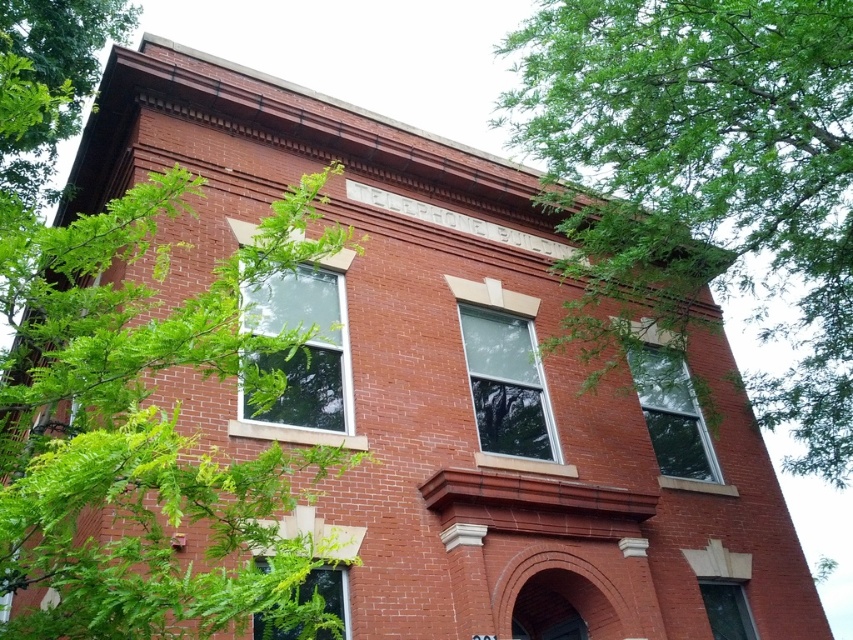
Is green leafy tree at upper left bigger than green leafy tree at upper right?

Yes, green leafy tree at upper left is bigger than green leafy tree at upper right.

Is point (126, 285) positioned behind point (798, 307)?

That is False.

Identify the location of green leafy tree at upper left. pos(143,426).